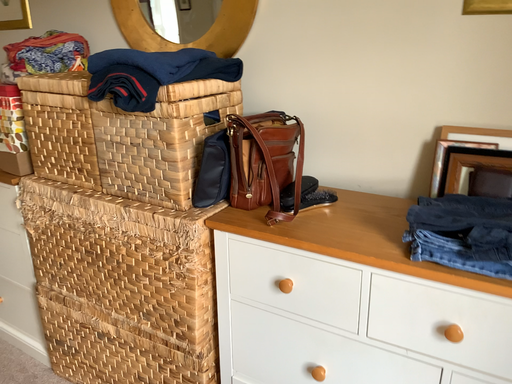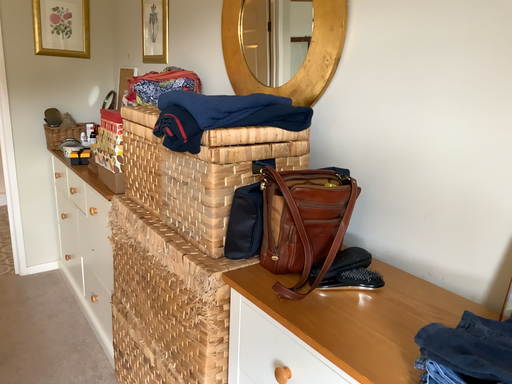
Question: How did the camera likely rotate when shooting the video?

Choices:
 (A) rotated downward
 (B) rotated upward

Answer: (B)